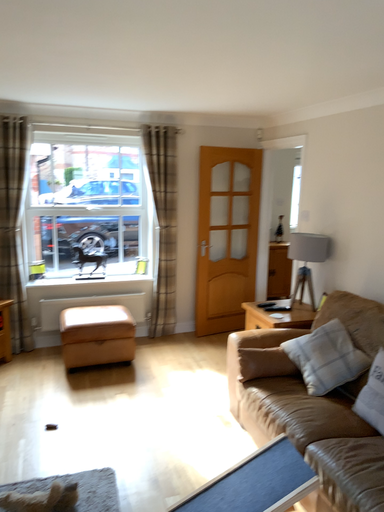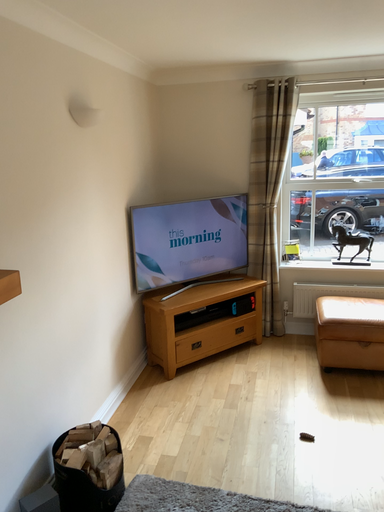
Question: How did the camera likely rotate when shooting the video?

Choices:
 (A) rotated right
 (B) rotated left

Answer: (B)